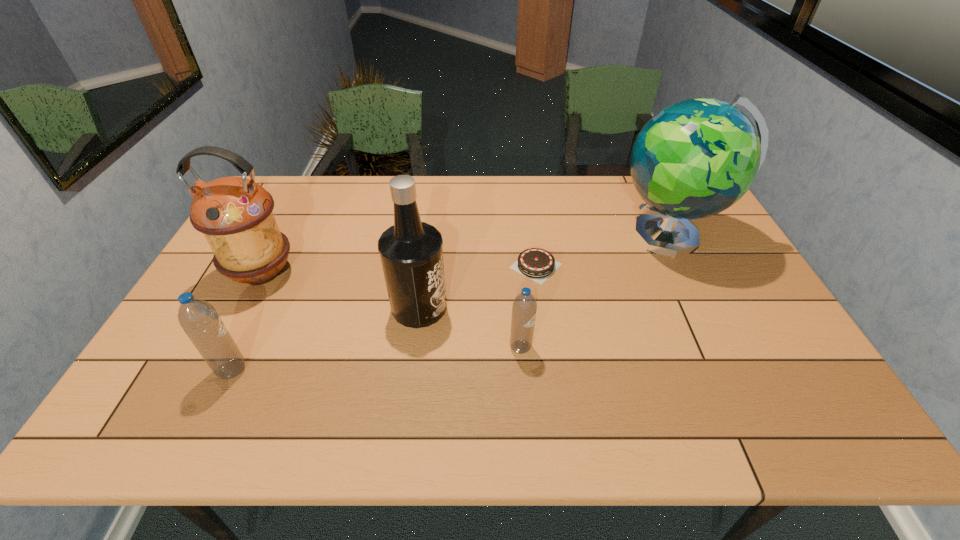
Locate an element on the screen. This screenshot has height=540, width=960. free spot between the oil lamp and the nearer water bottle is located at coordinates (247, 321).

Image resolution: width=960 pixels, height=540 pixels. In order to click on vacant space in between the rightmost object and the shortest object in this screenshot , I will do `click(603, 251)`.

Where is `object identified as the fourth closest to the globe`? The image size is (960, 540). object identified as the fourth closest to the globe is located at coordinates (235, 214).

Locate which object ranks in proximity to the oil lamp. Please provide its 2D coordinates. Your answer should be formatted as a tuple, i.e. [(x, y)], where the tuple contains the x and y coordinates of a point satisfying the conditions above.

[(198, 318)]

You are a GUI agent. You are given a task and a screenshot of the screen. Output one action in this format:
    pyautogui.click(x=<x>, y=<y>)
    Task: Click on the free point that satisfies the following two spatial constraints: 1. on the front side of the left water bottle; 2. on the right side of the oil lamp
    The height and width of the screenshot is (540, 960).
    Given the screenshot: What is the action you would take?
    [x=212, y=370]

Locate an element on the screen. blank space that satisfies the following two spatial constraints: 1. on the front surface of the rightmost object; 2. on the front side of the fifth farthest object is located at coordinates (724, 347).